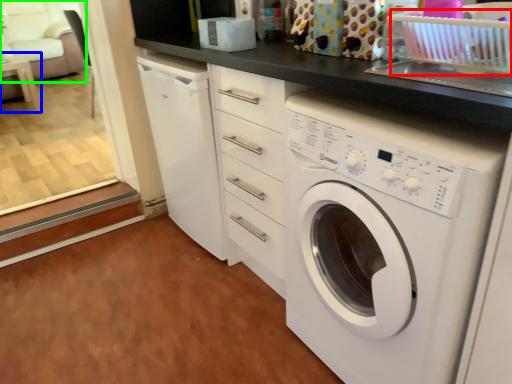
Question: Considering the real-world distances, which object is farthest from basket (highlighted by a red box)? table (highlighted by a blue box) or armchair (highlighted by a green box)?

Choices:
 (A) table
 (B) armchair

Answer: (B)